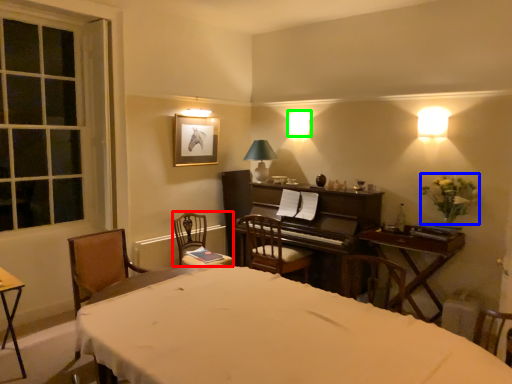
Question: Considering the real-world distances, which object is closest to chair (highlighted by a red box)? flower (highlighted by a blue box) or lamp (highlighted by a green box).

Choices:
 (A) flower
 (B) lamp

Answer: (B)